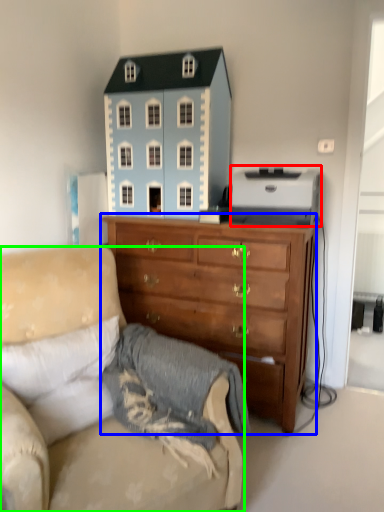
Question: Which object is the closest to the toy (highlighted by a red box)? Choose among these: chest of drawers (highlighted by a blue box) or studio couch (highlighted by a green box).

Choices:
 (A) chest of drawers
 (B) studio couch

Answer: (A)